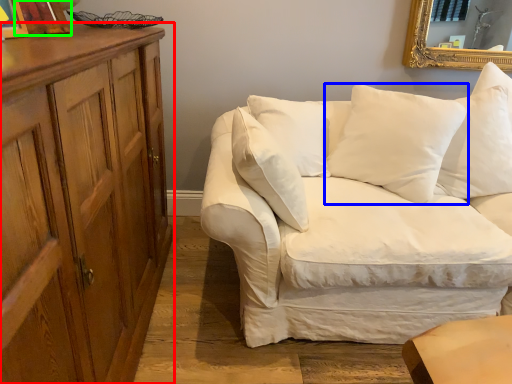
Question: Which object is the farthest from cabinetry (highlighted by a red box)? Choose among these: pillow (highlighted by a blue box) or picture frame (highlighted by a green box).

Choices:
 (A) pillow
 (B) picture frame

Answer: (A)